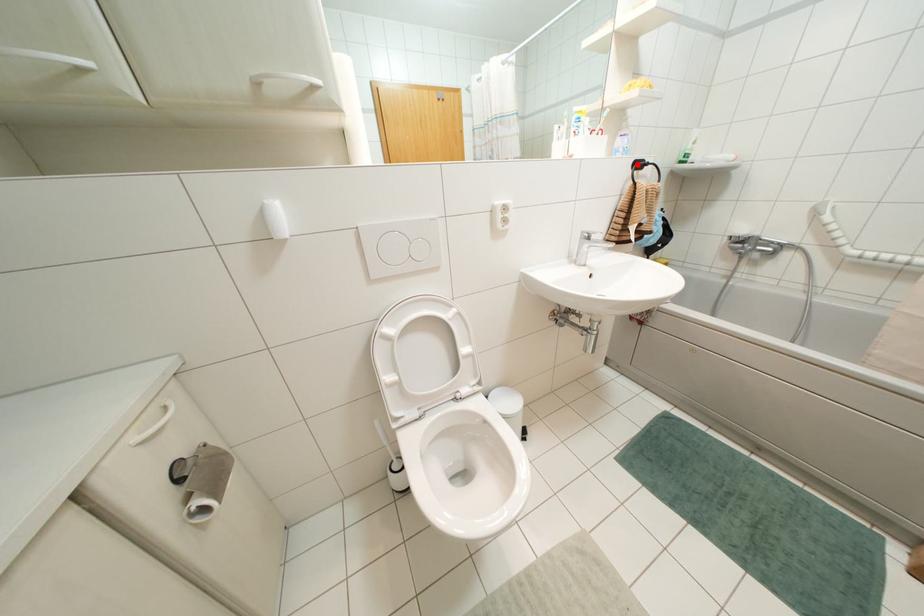
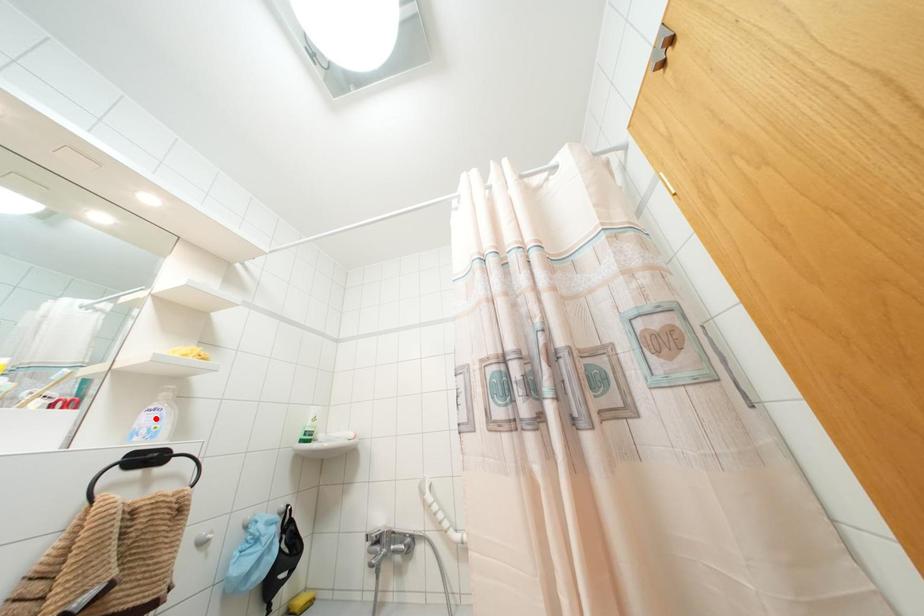
I am providing you with two images of the same scene from different viewpoints. A red point is marked on the first image and another point is marked on the second image. Is the marked point in image1 the same physical position as the marked point in image2?

No